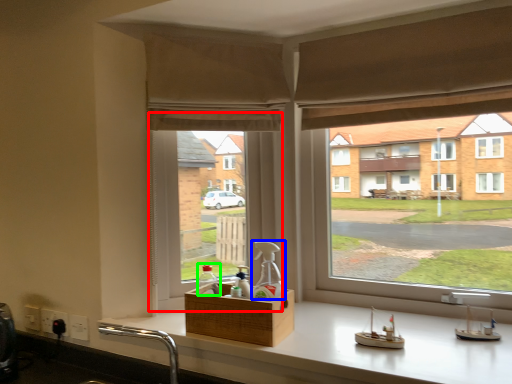
Question: Estimate the real-world distances between objects in this image. Which object is closer to window screen (highlighted by a red box), bottle (highlighted by a blue box) or bottle (highlighted by a green box)?

Choices:
 (A) bottle
 (B) bottle

Answer: (B)